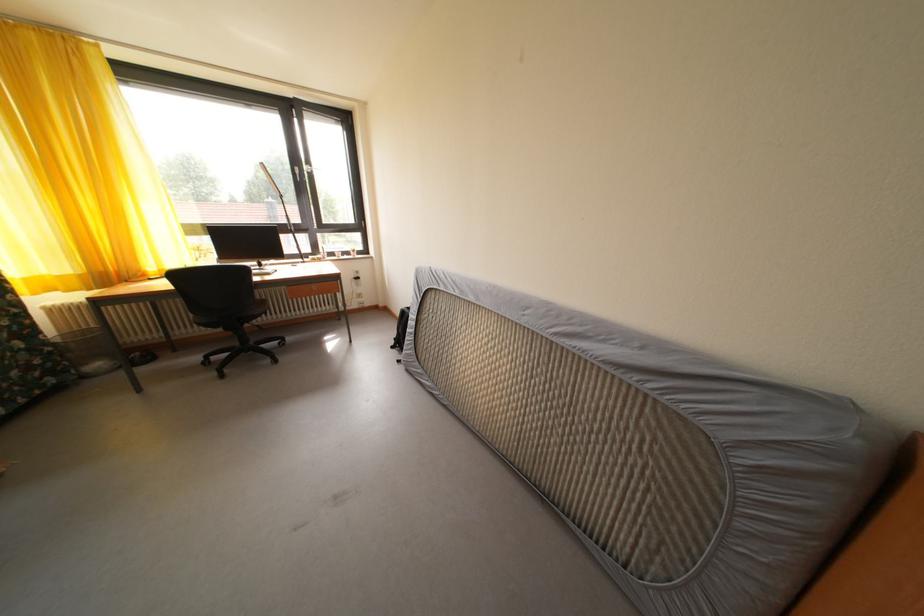
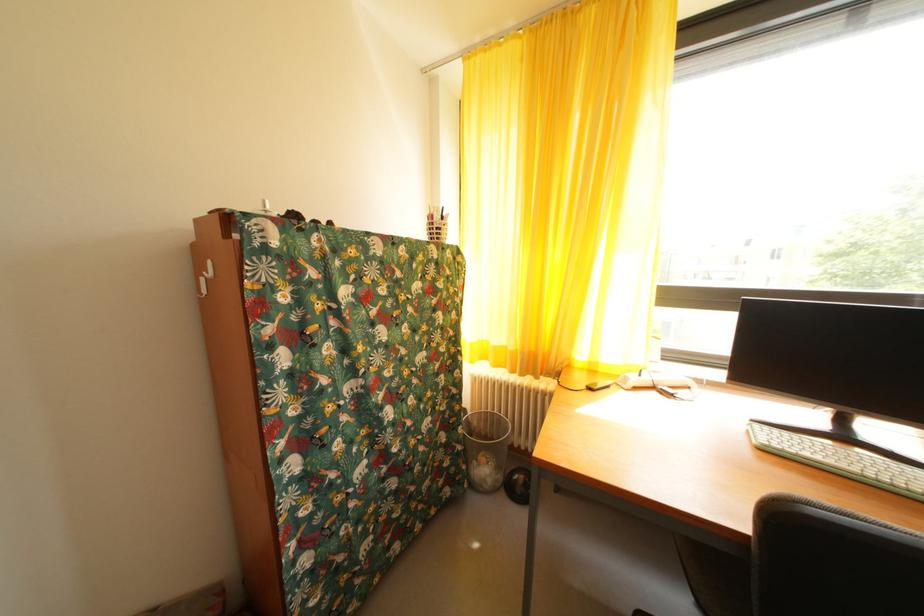
In the second image, find the point that corresponds to point 58,355 in the first image.

(468, 454)